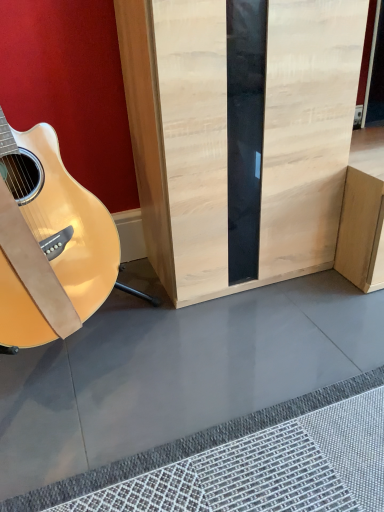
Locate an element on the screen. The width and height of the screenshot is (384, 512). natural wood cabinet at center is located at coordinates (226, 135).

The height and width of the screenshot is (512, 384). What do you see at coordinates (226, 135) in the screenshot?
I see `natural wood cabinet at center` at bounding box center [226, 135].

The height and width of the screenshot is (512, 384). I want to click on natural wood cabinet at center, so click(x=226, y=135).